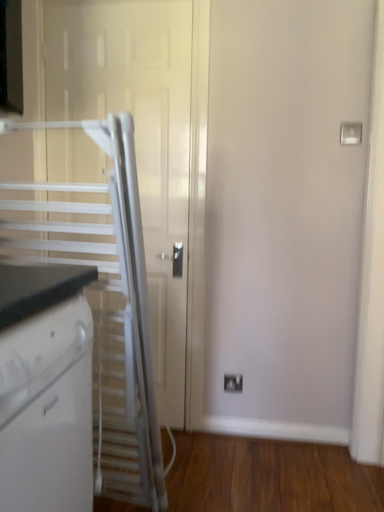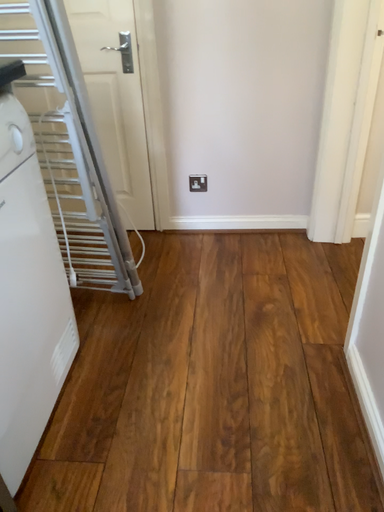
Question: Which way did the camera rotate in the video?

Choices:
 (A) rotated downward
 (B) rotated upward

Answer: (A)